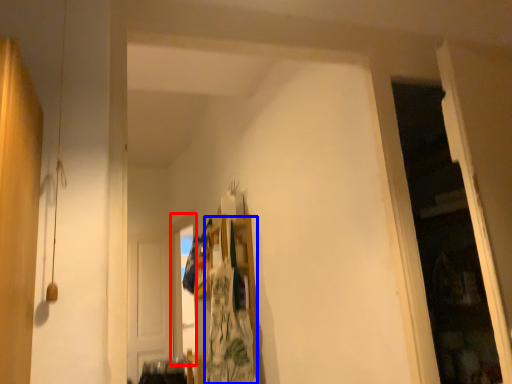
Question: Which of the following is the farthest to the observer, window (highlighted by a red box) or laundry (highlighted by a blue box)?

Choices:
 (A) window
 (B) laundry

Answer: (A)